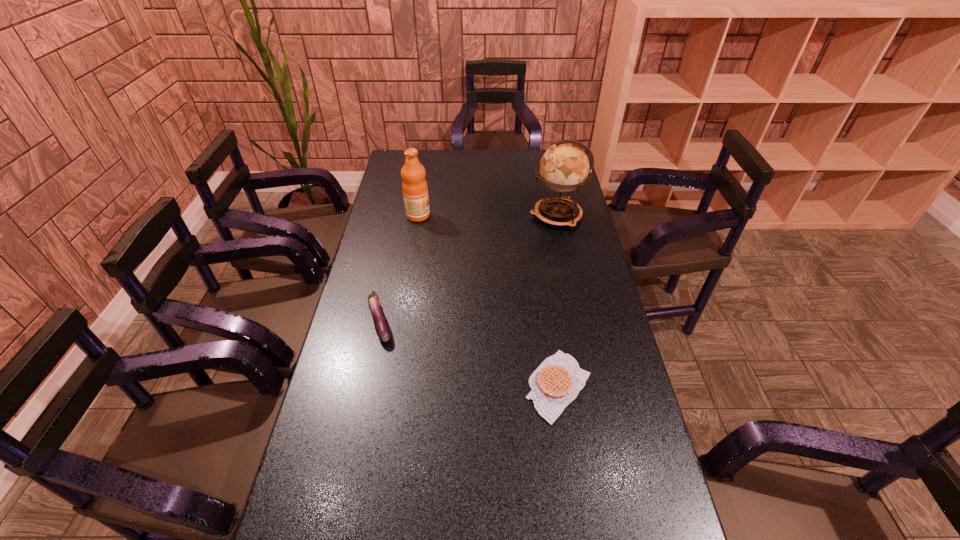
Locate which object ranks third in proximity to the fruit juice. Please provide its 2D coordinates. Your answer should be formatted as a tuple, i.e. [(x, y)], where the tuple contains the x and y coordinates of a point satisfying the conditions above.

[(557, 381)]

Find the location of a particular element. free point that satisfies the following two spatial constraints: 1. at the center of the tallest object; 2. on the front side of the third tallest object is located at coordinates (579, 322).

Where is `vacant region that satisfies the following two spatial constraints: 1. on the back side of the pie; 2. on the label side of the third shortest object`? vacant region that satisfies the following two spatial constraints: 1. on the back side of the pie; 2. on the label side of the third shortest object is located at coordinates (534, 215).

The image size is (960, 540). In order to click on free location that satisfies the following two spatial constraints: 1. on the front side of the shortest object; 2. on the right side of the second nearest object in this screenshot , I will do `click(367, 386)`.

What are the coordinates of `blank space that satisfies the following two spatial constraints: 1. on the label side of the third shortest object; 2. on the left side of the shortest object` in the screenshot? It's located at (389, 386).